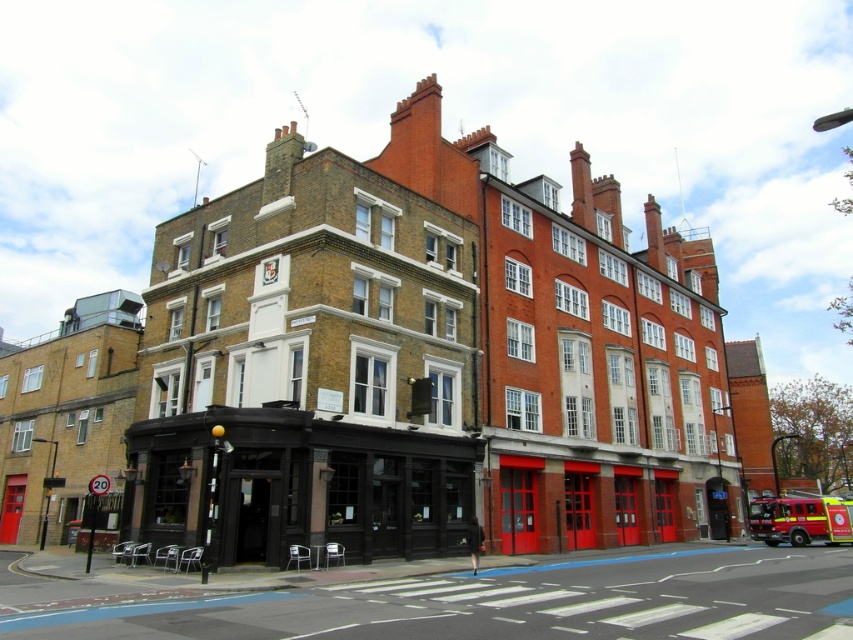
Question: Is brick building at center below brick building at left?

Choices:
 (A) yes
 (B) no

Answer: (B)

Question: Is brick building at left positioned in front of red matte fire truck at lower right?

Choices:
 (A) no
 (B) yes

Answer: (B)

Question: Which point is closer to the camera taking this photo?

Choices:
 (A) (41, 474)
 (B) (805, 497)

Answer: (A)

Question: Which object appears farthest from the camera in this image?

Choices:
 (A) brick building at center
 (B) red matte fire truck at lower right

Answer: (B)

Question: Does brick building at center come behind smooth asphalt road at lower center?

Choices:
 (A) yes
 (B) no

Answer: (A)

Question: Which object is positioned farthest from the red matte fire truck at lower right?

Choices:
 (A) brick building at left
 (B) smooth asphalt road at lower center
 (C) brick building at center

Answer: (A)